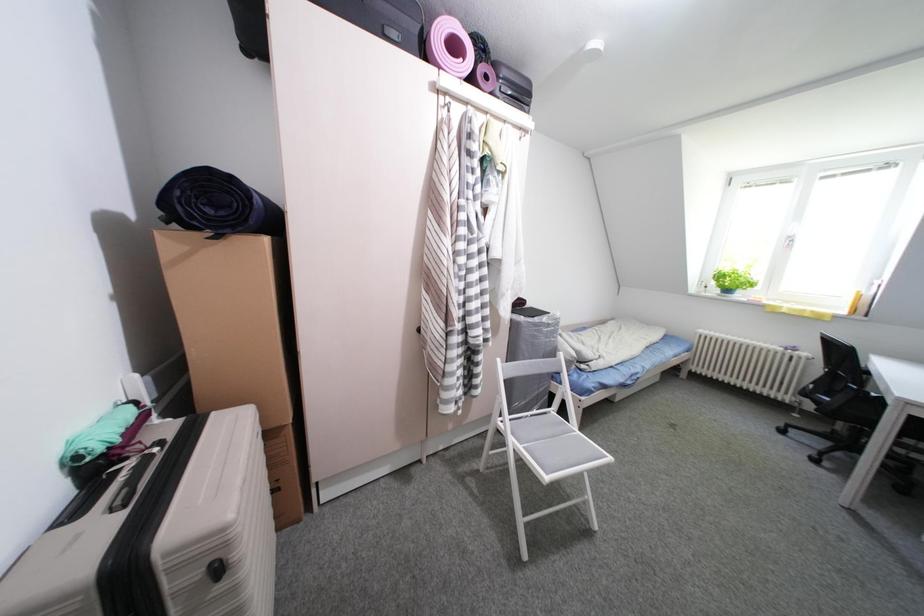
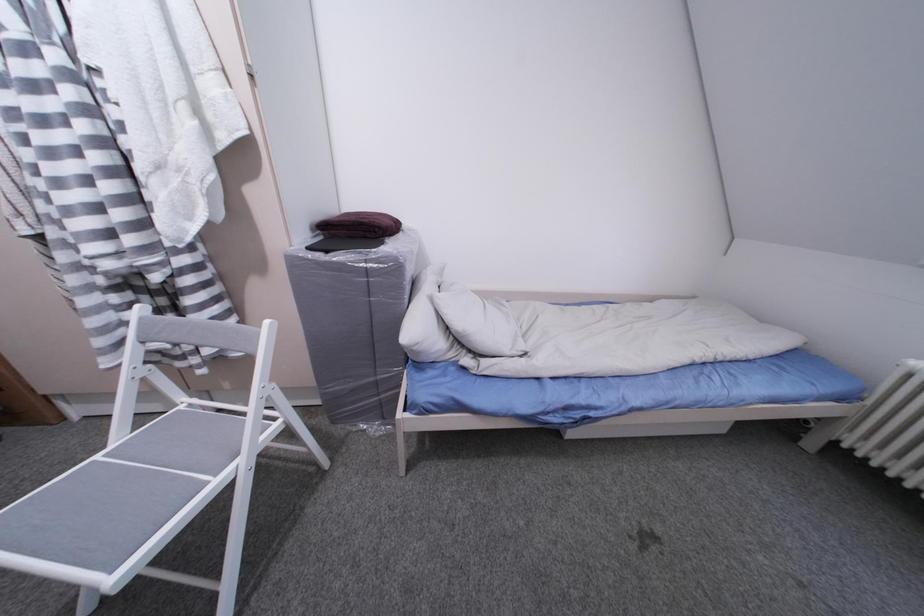
In a continuous first-person perspective shot, in which direction is the camera moving?

The cameraman walked toward right, forward.